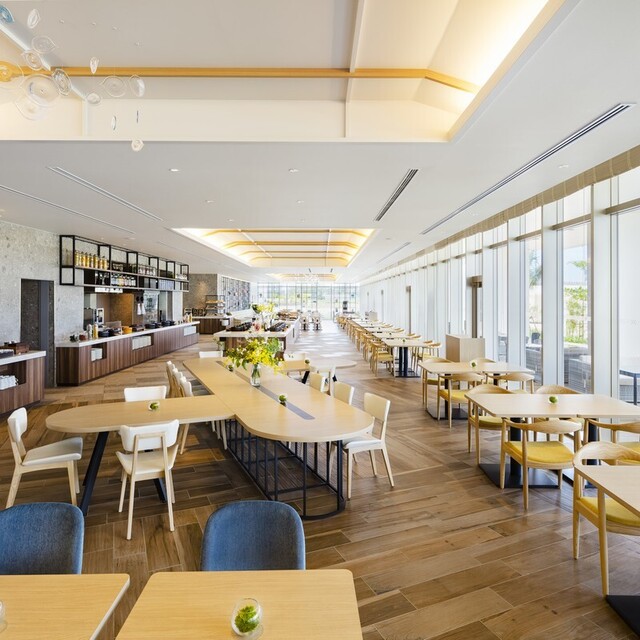
At what (x,y) coordinates should I click in order to perform the action: click on sections of shelving. Please return your answer as a coordinate pair (x, y). This screenshot has width=640, height=640. Looking at the image, I should click on (182, 269), (171, 269), (148, 268), (124, 267), (79, 259), (84, 276), (128, 280), (148, 278), (166, 285), (182, 280).